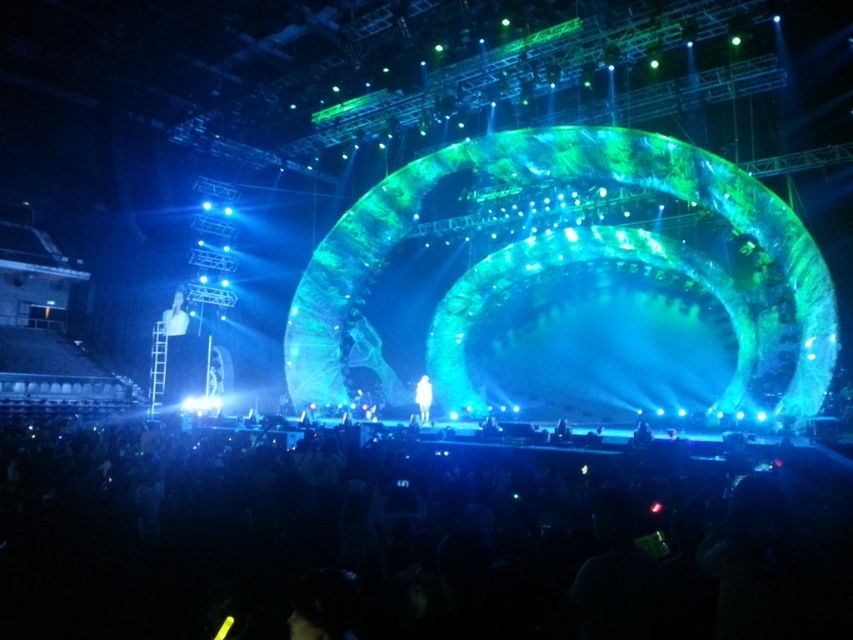
How much distance is there between white glossy figure at upper left and translucent white figure at center?

white glossy figure at upper left and translucent white figure at center are 32.87 meters apart from each other.

Which is above, white glossy figure at upper left or translucent white figure at center?

white glossy figure at upper left

Who is more distant from viewer, (171, 323) or (426, 378)?

The point (171, 323) is behind.

Locate an element on the screen. The height and width of the screenshot is (640, 853). white glossy figure at upper left is located at coordinates (175, 316).

Find the location of a particular element. This screenshot has width=853, height=640. black matte crowd at lower center is located at coordinates (416, 538).

Is black matte crowd at lower center to the left of translucent white figure at center from the viewer's perspective?

Yes, black matte crowd at lower center is to the left of translucent white figure at center.

Is point (619, 556) farther from viewer compared to point (422, 413)?

No, it is in front of (422, 413).

The height and width of the screenshot is (640, 853). In order to click on black matte crowd at lower center in this screenshot , I will do `click(416, 538)`.

Is black matte crowd at lower center shorter than white glossy figure at upper left?

No.

Which of these two, black matte crowd at lower center or white glossy figure at upper left, stands shorter?

With less height is white glossy figure at upper left.

Does point (440, 572) come behind point (170, 333)?

No, it is not.

Where is `black matte crowd at lower center`? black matte crowd at lower center is located at coordinates (416, 538).